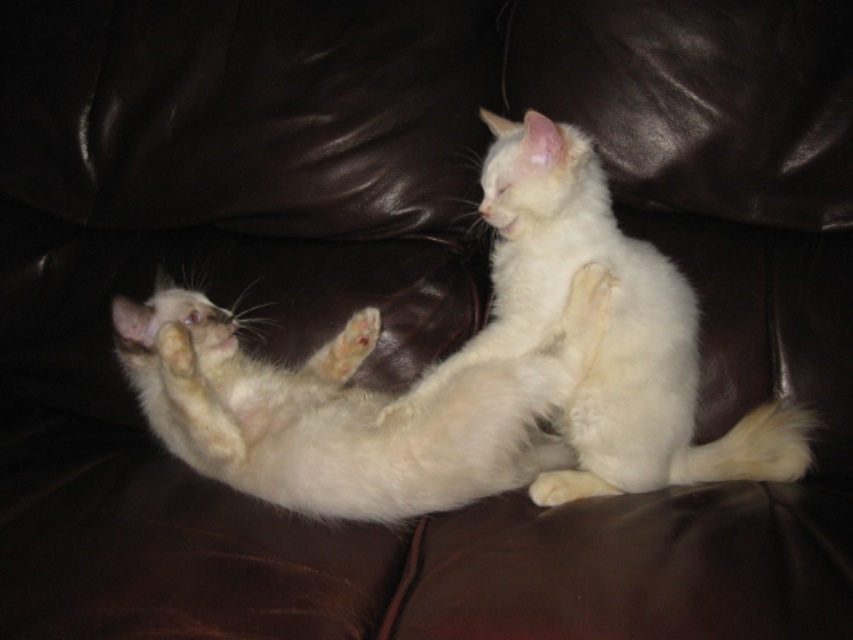
Between point (288, 452) and point (183, 353), which one is positioned behind?

Point (288, 452)

Does white fluffy cat at center have a lesser width compared to white fur paw at center?

Incorrect, white fluffy cat at center's width is not less than white fur paw at center's.

This screenshot has width=853, height=640. Find the location of `white fluffy cat at center`. white fluffy cat at center is located at coordinates tap(352, 412).

Is white fluffy cat at upper right shorter than white fur paw at center?

No, white fluffy cat at upper right is not shorter than white fur paw at center.

The height and width of the screenshot is (640, 853). What are the coordinates of `white fluffy cat at upper right` in the screenshot? It's located at (604, 328).

The height and width of the screenshot is (640, 853). In order to click on white fluffy cat at upper right in this screenshot , I will do `click(604, 328)`.

Which is behind, point (503, 372) or point (693, 401)?

Point (693, 401)

Between point (582, 298) and point (682, 467), which one is positioned behind?

The point (682, 467) is more distant.

Locate an element on the screen. The width and height of the screenshot is (853, 640). white fluffy cat at center is located at coordinates 352,412.